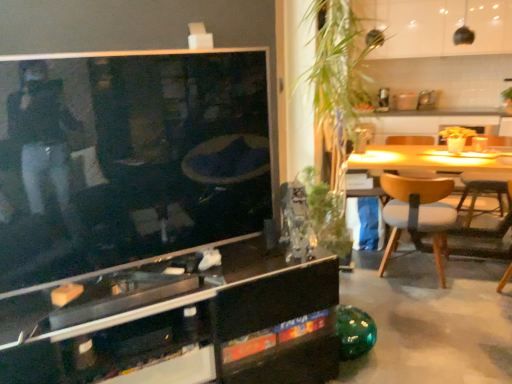
Question: Is the surface of green glass vase at center, the 1th plant in the bottom-to-top sequence, in direct contact with black glass cabinet at center?

Choices:
 (A) yes
 (B) no

Answer: (B)

Question: Is green glass vase at center, marked as the 2th plant in a top-to-bottom arrangement, bigger than black glass cabinet at center?

Choices:
 (A) yes
 (B) no

Answer: (B)

Question: Is green glass vase at center, the 1th plant in the bottom-to-top sequence, wider than black glass cabinet at center?

Choices:
 (A) no
 (B) yes

Answer: (A)

Question: Considering the relative sizes of green glass vase at center, marked as the 2th plant in a top-to-bottom arrangement, and black glass cabinet at center in the image provided, is green glass vase at center, marked as the 2th plant in a top-to-bottom arrangement, thinner than black glass cabinet at center?

Choices:
 (A) yes
 (B) no

Answer: (A)

Question: Is green glass vase at center, marked as the 2th plant in a top-to-bottom arrangement, not inside black glass cabinet at center?

Choices:
 (A) yes
 (B) no

Answer: (A)

Question: Is light brown wood chair at right, which is the 1th chair in front-to-back order, situated inside green leafy plant at center, which is the first plant in top-to-bottom order, or outside?

Choices:
 (A) outside
 (B) inside

Answer: (A)

Question: Considering the positions of light brown wood chair at right, acting as the 2th chair starting from the right, and green leafy plant at center, which is the 2th plant in bottom-to-top order, in the image, is light brown wood chair at right, acting as the 2th chair starting from the right, taller or shorter than green leafy plant at center, which is the 2th plant in bottom-to-top order,?

Choices:
 (A) short
 (B) tall

Answer: (A)

Question: Is light brown wood chair at right, positioned as the second chair in back-to-front order, wider or thinner than green leafy plant at center, which is the 2th plant in bottom-to-top order?

Choices:
 (A) wide
 (B) thin

Answer: (B)

Question: Does point coord(431,196) appear closer or farther from the camera than point coord(333,177)?

Choices:
 (A) farther
 (B) closer

Answer: (B)

Question: Based on their sizes in the image, would you say wooden chair at right, which ranks as the second chair in left-to-right order, is bigger or smaller than light brown wood chair at right, positioned as the second chair in back-to-front order?

Choices:
 (A) small
 (B) big

Answer: (A)

Question: Does point (473, 203) appear closer or farther from the camera than point (419, 192)?

Choices:
 (A) closer
 (B) farther

Answer: (B)

Question: In the image, is wooden chair at right, marked as the 1th chair in a right-to-left arrangement, on the left side or the right side of light brown wood chair at right, placed as the first chair when sorted from left to right?

Choices:
 (A) left
 (B) right

Answer: (B)

Question: From their relative heights in the image, would you say wooden chair at right, which ranks as the 2th chair in front-to-back order, is taller or shorter than light brown wood chair at right, positioned as the second chair in back-to-front order?

Choices:
 (A) short
 (B) tall

Answer: (B)

Question: Is green leafy plant at center, which is the first plant in top-to-bottom order, taller or shorter than wooden chair at right, which ranks as the second chair in left-to-right order?

Choices:
 (A) short
 (B) tall

Answer: (B)

Question: Would you say green leafy plant at center, which is the 2th plant in bottom-to-top order, is inside or outside wooden chair at right, which ranks as the 2th chair in front-to-back order?

Choices:
 (A) outside
 (B) inside

Answer: (A)